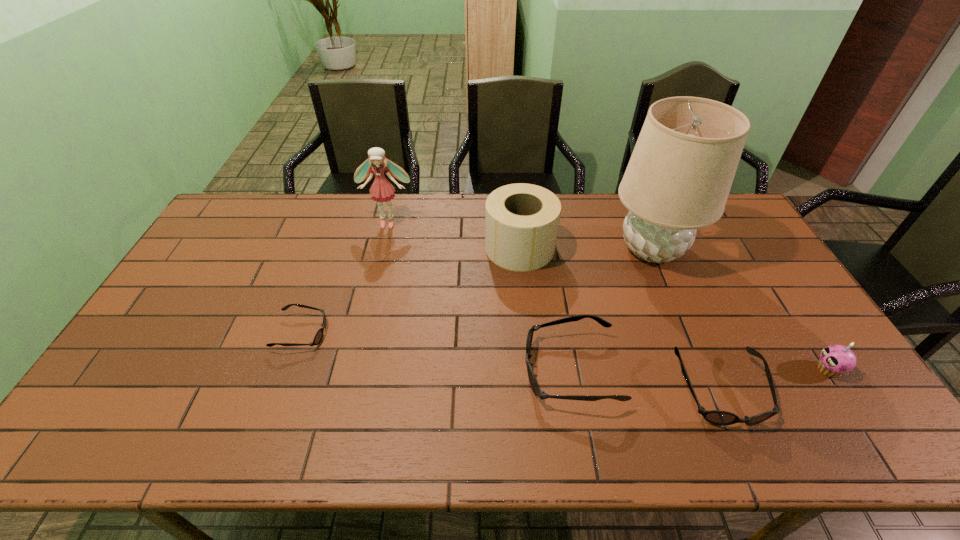
Identify the location of free space that is in between the fifth shortest object and the cupcake. (674, 309).

The height and width of the screenshot is (540, 960). I want to click on the closest object relative to the third tallest object, so click(678, 179).

Where is `object that can be found as the third closest to the toilet tissue`? object that can be found as the third closest to the toilet tissue is located at coordinates (382, 190).

The height and width of the screenshot is (540, 960). I want to click on sunglasses identified as the closest to the tallest object, so click(533, 382).

Locate an element on the screen. This screenshot has width=960, height=540. sunglasses that is the closest to the shortest sunglasses is located at coordinates pos(533,382).

Locate an element on the screen. vacant area in the image that satisfies the following two spatial constraints: 1. on the front side of the lampshade; 2. on the lenses of the leftmost sunglasses is located at coordinates (686, 333).

Identify the location of free space that satisfies the following two spatial constraints: 1. on the front-facing side of the doll; 2. on the lenses of the shortest object. (362, 333).

At what (x,y) coordinates should I click in order to perform the action: click on vacant point that satisfies the following two spatial constraints: 1. on the front-facing side of the sixth shortest object; 2. on the lenses of the shortest sunglasses. Please return your answer as a coordinate pair (x, y). Looking at the image, I should click on [362, 333].

Where is `free space in the image that satisfies the following two spatial constraints: 1. on the face of the rightmost object; 2. on the lenses of the rightmost sunglasses`? free space in the image that satisfies the following two spatial constraints: 1. on the face of the rightmost object; 2. on the lenses of the rightmost sunglasses is located at coordinates (842, 390).

Where is `free space that satisfies the following two spatial constraints: 1. on the front-facing side of the lampshade; 2. on the right side of the second object from left to right`? free space that satisfies the following two spatial constraints: 1. on the front-facing side of the lampshade; 2. on the right side of the second object from left to right is located at coordinates (382, 249).